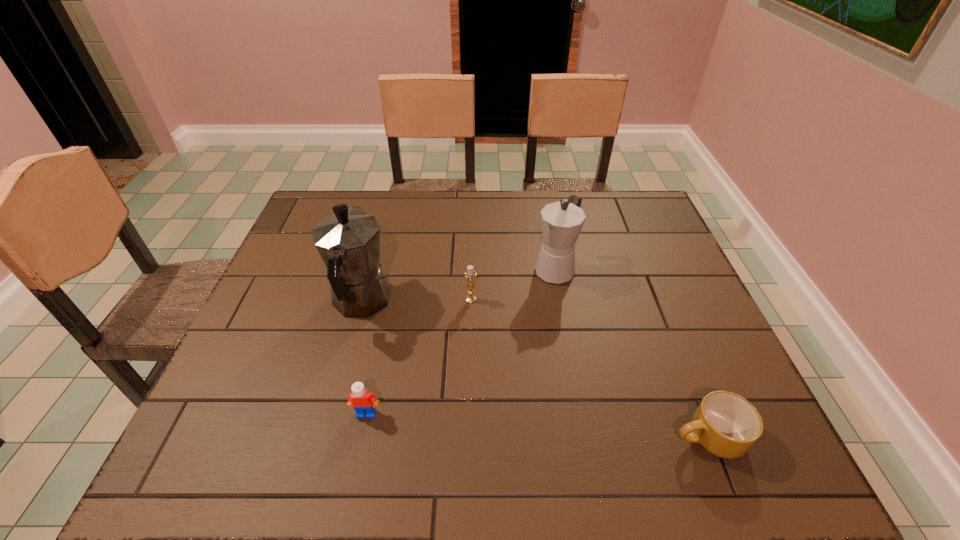
Locate an element on the screen. The width and height of the screenshot is (960, 540). unoccupied position between the shortest object and the left coffeepot is located at coordinates (534, 370).

This screenshot has height=540, width=960. What are the coordinates of `free point between the rightmost object and the Lego` in the screenshot? It's located at (537, 426).

You are a GUI agent. You are given a task and a screenshot of the screen. Output one action in this format:
    pyautogui.click(x=<x>, y=<y>)
    Task: Click on the blank region between the tallest object and the rightmost object
    The height and width of the screenshot is (540, 960).
    Given the screenshot: What is the action you would take?
    pyautogui.click(x=534, y=370)

Locate an element on the screen. This screenshot has height=540, width=960. vacant area between the Lego and the candle holder is located at coordinates coord(419,356).

The image size is (960, 540). Identify the location of vacant area between the right coffeepot and the rightmost object. (631, 353).

Locate an element on the screen. The image size is (960, 540). the second closest object to the candle holder is located at coordinates (348, 241).

Locate an element on the screen. The height and width of the screenshot is (540, 960). object that is the third closest to the rightmost object is located at coordinates (363, 401).

At what (x,y) coordinates should I click in order to perform the action: click on vacant space that satisfies the following two spatial constraints: 1. on the pouring side of the right coffeepot; 2. on the left side of the taller coffeepot. Please return your answer as a coordinate pair (x, y). Looking at the image, I should click on (370, 269).

The height and width of the screenshot is (540, 960). What are the coordinates of `vacant space that satisfies the following two spatial constraints: 1. on the side with the handle of the rightmost object; 2. on the face of the Lego` in the screenshot? It's located at (697, 414).

I want to click on vacant area that satisfies the following two spatial constraints: 1. on the back side of the fourth shortest object; 2. on the right side of the third object from right to left, so click(x=471, y=269).